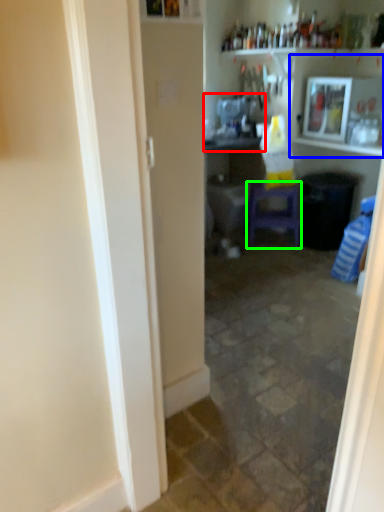
Question: Which object is positioned closest to sink (highlighted by a red box)? Select from shelf (highlighted by a blue box) and furniture (highlighted by a green box).

Choices:
 (A) shelf
 (B) furniture

Answer: (A)